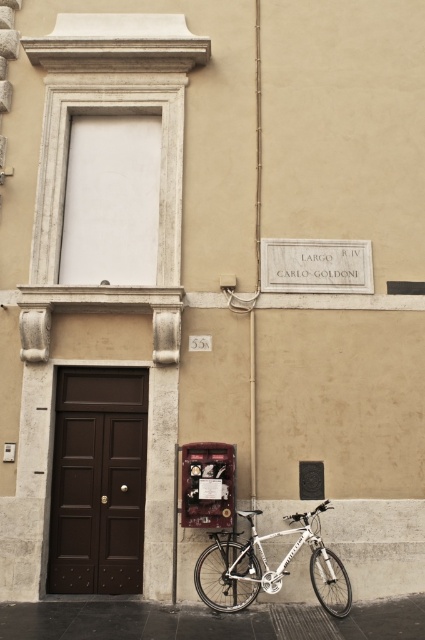
Question: Which point is farther to the camera?

Choices:
 (A) (274, 532)
 (B) (181, 464)

Answer: (A)

Question: Considering the relative positions of silver metallic bicycle at lower center and metallic red phone box at lower center in the image provided, where is silver metallic bicycle at lower center located with respect to metallic red phone box at lower center?

Choices:
 (A) left
 (B) right

Answer: (B)

Question: Can you confirm if brown wooden door at center is positioned above silver metallic bicycle at lower center?

Choices:
 (A) no
 (B) yes

Answer: (B)

Question: Is brown wooden door at center wider than silver metallic bicycle at lower center?

Choices:
 (A) no
 (B) yes

Answer: (A)

Question: Which object appears closest to the camera in this image?

Choices:
 (A) silver metallic bicycle at lower center
 (B) brown wooden door at center

Answer: (A)

Question: Which of the following is the farthest from the observer?

Choices:
 (A) silver metallic bicycle at lower center
 (B) brown wooden door at center
 (C) metallic red phone box at lower center

Answer: (B)